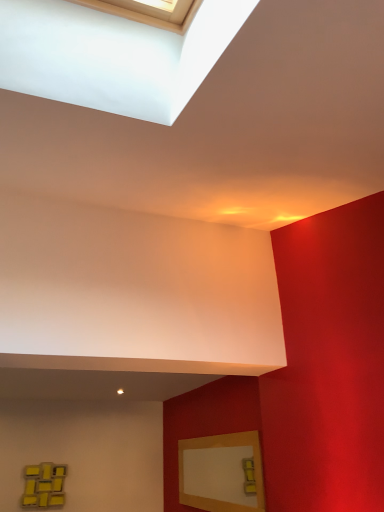
What do you see at coordinates (44, 485) in the screenshot?
I see `yellow matte picture frame at lower left, the 2th picture frame in the front-to-back sequence` at bounding box center [44, 485].

Image resolution: width=384 pixels, height=512 pixels. What are the coordinates of `yellow matte picture frame at lower left, the 2th picture frame from the right` in the screenshot? It's located at (44, 485).

Measure the distance between yellow matte picture frame at lower left, the first picture frame viewed from the left, and camera.

The depth of yellow matte picture frame at lower left, the first picture frame viewed from the left, is 4.71 meters.

Locate an element on the screen. The height and width of the screenshot is (512, 384). matte wood picture frame at lower right, which is the first picture frame from right to left is located at coordinates (220, 472).

The width and height of the screenshot is (384, 512). What do you see at coordinates (220, 472) in the screenshot?
I see `matte wood picture frame at lower right, which appears as the second picture frame when viewed from the left` at bounding box center [220, 472].

Locate an element on the screen. yellow matte picture frame at lower left, the 2th picture frame from the right is located at coordinates (44, 485).

Which object is positioned more to the right, yellow matte picture frame at lower left, the first picture frame viewed from the left, or matte wood picture frame at lower right, which appears as the second picture frame when viewed from the left?

matte wood picture frame at lower right, which appears as the second picture frame when viewed from the left.

Considering the positions of objects yellow matte picture frame at lower left, the first picture frame viewed from the left, and matte wood picture frame at lower right, the first picture frame viewed from the front, in the image provided, who is in front, yellow matte picture frame at lower left, the first picture frame viewed from the left, or matte wood picture frame at lower right, the first picture frame viewed from the front,?

matte wood picture frame at lower right, the first picture frame viewed from the front, is in front.

Is point (32, 490) closer to viewer compared to point (232, 441)?

That is False.

From the image's perspective, between yellow matte picture frame at lower left, the 2th picture frame in the front-to-back sequence, and matte wood picture frame at lower right, the first picture frame viewed from the front, who is located below?

yellow matte picture frame at lower left, the 2th picture frame in the front-to-back sequence, appears lower in the image.

From a real-world perspective, which object rests below the other?

In real-world perspective, yellow matte picture frame at lower left, the 2th picture frame in the front-to-back sequence, is lower.

Considering the sizes of objects yellow matte picture frame at lower left, the 2th picture frame in the front-to-back sequence, and matte wood picture frame at lower right, the 2th picture frame from the back, in the image provided, who is thinner, yellow matte picture frame at lower left, the 2th picture frame in the front-to-back sequence, or matte wood picture frame at lower right, the 2th picture frame from the back,?

With smaller width is matte wood picture frame at lower right, the 2th picture frame from the back.

Based on the photo, is yellow matte picture frame at lower left, the first picture frame viewed from the left, taller than matte wood picture frame at lower right, the first picture frame viewed from the front?

No.

Can you confirm if yellow matte picture frame at lower left, the first picture frame viewed from the left, is smaller than matte wood picture frame at lower right, which appears as the second picture frame when viewed from the left?

Yes, yellow matte picture frame at lower left, the first picture frame viewed from the left, is smaller than matte wood picture frame at lower right, which appears as the second picture frame when viewed from the left.

Is yellow matte picture frame at lower left, the 2th picture frame from the right, completely or partially outside of matte wood picture frame at lower right, the 2th picture frame from the back?

yellow matte picture frame at lower left, the 2th picture frame from the right, lies outside matte wood picture frame at lower right, the 2th picture frame from the back,'s area.

Is yellow matte picture frame at lower left, the first picture frame viewed from the left, in contact with matte wood picture frame at lower right, which is the first picture frame from right to left?

yellow matte picture frame at lower left, the first picture frame viewed from the left, is not next to matte wood picture frame at lower right, which is the first picture frame from right to left, and they're not touching.

Is yellow matte picture frame at lower left, the 2th picture frame from the right, turned away from matte wood picture frame at lower right, which is the first picture frame from right to left?

No, matte wood picture frame at lower right, which is the first picture frame from right to left, is not at the back of yellow matte picture frame at lower left, the 2th picture frame from the right.

Locate an element on the screen. picture frame located in front of the yellow matte picture frame at lower left, arranged as the 1th picture frame when viewed from the back is located at coordinates (220, 472).

Which object is positioned more to the left, matte wood picture frame at lower right, the first picture frame viewed from the front, or yellow matte picture frame at lower left, the 2th picture frame in the front-to-back sequence?

yellow matte picture frame at lower left, the 2th picture frame in the front-to-back sequence.

Is the position of matte wood picture frame at lower right, which appears as the second picture frame when viewed from the left, more distant than that of yellow matte picture frame at lower left, the first picture frame viewed from the left?

No, matte wood picture frame at lower right, which appears as the second picture frame when viewed from the left, is closer to the viewer.

Between point (216, 507) and point (26, 482), which one is positioned behind?

Point (26, 482)

From the image's perspective, is matte wood picture frame at lower right, which appears as the second picture frame when viewed from the left, above or below yellow matte picture frame at lower left, the 2th picture frame from the right?

matte wood picture frame at lower right, which appears as the second picture frame when viewed from the left, is situated higher than yellow matte picture frame at lower left, the 2th picture frame from the right, in the image.

From a real-world perspective, is matte wood picture frame at lower right, the 2th picture frame from the back, below yellow matte picture frame at lower left, the 2th picture frame in the front-to-back sequence?

No, from a real-world perspective, matte wood picture frame at lower right, the 2th picture frame from the back, is not under yellow matte picture frame at lower left, the 2th picture frame in the front-to-back sequence.

Considering the relative sizes of matte wood picture frame at lower right, which appears as the second picture frame when viewed from the left, and yellow matte picture frame at lower left, the first picture frame viewed from the left, in the image provided, is matte wood picture frame at lower right, which appears as the second picture frame when viewed from the left, thinner than yellow matte picture frame at lower left, the first picture frame viewed from the left,?

Yes, matte wood picture frame at lower right, which appears as the second picture frame when viewed from the left, is thinner than yellow matte picture frame at lower left, the first picture frame viewed from the left.

Considering the relative sizes of matte wood picture frame at lower right, the first picture frame viewed from the front, and yellow matte picture frame at lower left, the 2th picture frame from the right, in the image provided, is matte wood picture frame at lower right, the first picture frame viewed from the front, taller than yellow matte picture frame at lower left, the 2th picture frame from the right,?

Correct, matte wood picture frame at lower right, the first picture frame viewed from the front, is much taller as yellow matte picture frame at lower left, the 2th picture frame from the right.

Based on the photo, considering the relative sizes of matte wood picture frame at lower right, which is the first picture frame from right to left, and yellow matte picture frame at lower left, the 2th picture frame in the front-to-back sequence, in the image provided, is matte wood picture frame at lower right, which is the first picture frame from right to left, bigger than yellow matte picture frame at lower left, the 2th picture frame in the front-to-back sequence,?

Correct, matte wood picture frame at lower right, which is the first picture frame from right to left, is larger in size than yellow matte picture frame at lower left, the 2th picture frame in the front-to-back sequence.

Is matte wood picture frame at lower right, which is the first picture frame from right to left, spatially inside yellow matte picture frame at lower left, the 2th picture frame from the right, or outside of it?

matte wood picture frame at lower right, which is the first picture frame from right to left, is not inside yellow matte picture frame at lower left, the 2th picture frame from the right, it's outside.

Would you consider matte wood picture frame at lower right, the first picture frame viewed from the front, to be distant from yellow matte picture frame at lower left, the first picture frame viewed from the left?

Indeed, matte wood picture frame at lower right, the first picture frame viewed from the front, is not near yellow matte picture frame at lower left, the first picture frame viewed from the left.

Could you tell me if matte wood picture frame at lower right, which is the first picture frame from right to left, is facing yellow matte picture frame at lower left, the first picture frame viewed from the left?

Yes.

Measure the distance from matte wood picture frame at lower right, the first picture frame viewed from the front, to yellow matte picture frame at lower left, arranged as the 1th picture frame when viewed from the back.

matte wood picture frame at lower right, the first picture frame viewed from the front, is 1.77 meters from yellow matte picture frame at lower left, arranged as the 1th picture frame when viewed from the back.

Locate an element on the screen. Image resolution: width=384 pixels, height=512 pixels. picture frame behind the matte wood picture frame at lower right, the 2th picture frame from the back is located at coordinates (44, 485).

Image resolution: width=384 pixels, height=512 pixels. What are the coordinates of `picture frame on the left side of matte wood picture frame at lower right, which is the first picture frame from right to left` in the screenshot? It's located at (44, 485).

The width and height of the screenshot is (384, 512). In order to click on picture frame directly beneath the matte wood picture frame at lower right, the first picture frame viewed from the front (from a real-world perspective) in this screenshot , I will do `click(44, 485)`.